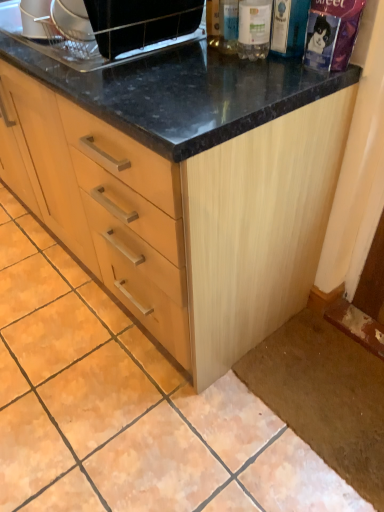
In order to click on free space in front of clear plastic bottle at upper right, positioned as the second bottle in right-to-left order in this screenshot , I will do pos(255,77).